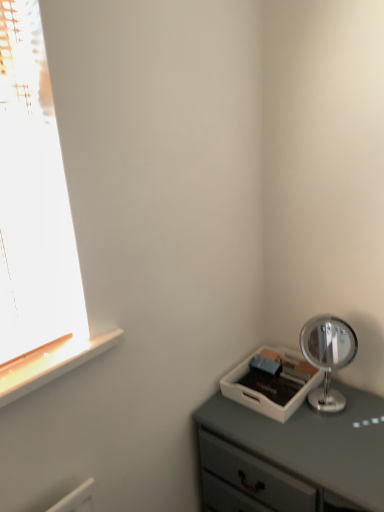
Locate an element on the screen. polished silver mirror at right is located at coordinates (327, 356).

Describe the element at coordinates (327, 356) in the screenshot. I see `polished silver mirror at right` at that location.

The width and height of the screenshot is (384, 512). In order to click on white plastic tray at lower right in this screenshot , I will do `click(293, 457)`.

What do you see at coordinates (293, 457) in the screenshot? This screenshot has width=384, height=512. I see `white plastic tray at lower right` at bounding box center [293, 457].

Find the location of a particular element. polished silver mirror at right is located at coordinates (327, 356).

Can you confirm if white plastic tray at lower right is positioned to the left of polished silver mirror at right?

Indeed, white plastic tray at lower right is positioned on the left side of polished silver mirror at right.

Which object is closer to the camera taking this photo, white plastic tray at lower right or polished silver mirror at right?

white plastic tray at lower right is more forward.

Is point (207, 489) positioned behind point (312, 320)?

No, (207, 489) is in front of (312, 320).

From the image's perspective, is white plastic tray at lower right on polished silver mirror at right?

No, from the image's perspective, white plastic tray at lower right is not above polished silver mirror at right.

From a real-world perspective, who is located lower, white plastic tray at lower right or polished silver mirror at right?

white plastic tray at lower right, from a real-world perspective.

Which object is wider, white plastic tray at lower right or polished silver mirror at right?

With larger width is white plastic tray at lower right.

Considering the sizes of objects white plastic tray at lower right and polished silver mirror at right in the image provided, who is shorter, white plastic tray at lower right or polished silver mirror at right?

Standing shorter between the two is polished silver mirror at right.

Can you confirm if white plastic tray at lower right is smaller than polished silver mirror at right?

No.

Do you think white plastic tray at lower right is within polished silver mirror at right, or outside of it?

white plastic tray at lower right cannot be found inside polished silver mirror at right.

Is white plastic tray at lower right far from polished silver mirror at right?

No.

Is white plastic tray at lower right oriented towards polished silver mirror at right?

No.

How different are the orientations of white plastic tray at lower right and polished silver mirror at right in degrees?

The facing directions of white plastic tray at lower right and polished silver mirror at right are 32.6 degrees apart.

Image resolution: width=384 pixels, height=512 pixels. In order to click on table lamp behind the white plastic tray at lower right in this screenshot , I will do click(327, 356).

In the scene shown: Is polished silver mirror at right to the right of white plastic tray at lower right from the viewer's perspective?

Correct, you'll find polished silver mirror at right to the right of white plastic tray at lower right.

Is polished silver mirror at right positioned behind white plastic tray at lower right?

Yes, polished silver mirror at right is further from the camera.

Which is in front, point (331, 366) or point (291, 473)?

Positioned in front is point (291, 473).

From the image's perspective, which one is positioned lower, polished silver mirror at right or white plastic tray at lower right?

white plastic tray at lower right, from the image's perspective.

From a real-world perspective, which is physically above, polished silver mirror at right or white plastic tray at lower right?

From a 3D spatial view, polished silver mirror at right is above.

Considering the sizes of polished silver mirror at right and white plastic tray at lower right in the image, is polished silver mirror at right wider or thinner than white plastic tray at lower right?

polished silver mirror at right is thinner than white plastic tray at lower right.

Between polished silver mirror at right and white plastic tray at lower right, which one has less height?

Standing shorter between the two is polished silver mirror at right.

Between polished silver mirror at right and white plastic tray at lower right, which one has smaller size?

With smaller size is polished silver mirror at right.

Would you say polished silver mirror at right is outside white plastic tray at lower right?

Absolutely, polished silver mirror at right is external to white plastic tray at lower right.

From the picture: Is polished silver mirror at right far away from white plastic tray at lower right?

No, polished silver mirror at right is not far away from white plastic tray at lower right.

Does polished silver mirror at right turn towards white plastic tray at lower right?

No, polished silver mirror at right does not turn towards white plastic tray at lower right.

What are the coordinates of `the chest of drawers below the polished silver mirror at right (from the image's perspective)` in the screenshot? It's located at click(x=293, y=457).

You are a GUI agent. You are given a task and a screenshot of the screen. Output one action in this format:
    pyautogui.click(x=<x>, y=<y>)
    Task: Click on the chest of drawers that is on the left side of polished silver mirror at right
    This screenshot has height=512, width=384.
    Given the screenshot: What is the action you would take?
    pyautogui.click(x=293, y=457)

I want to click on the chest of drawers that appears in front of the polished silver mirror at right, so click(293, 457).